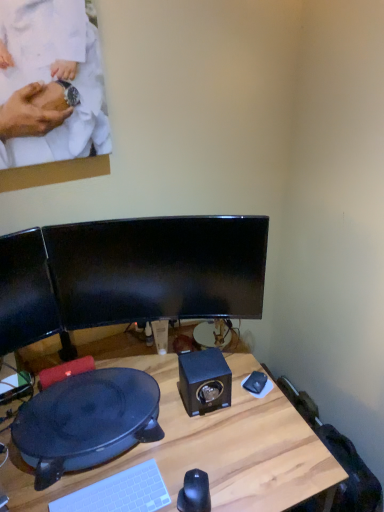
This screenshot has height=512, width=384. I want to click on free space above white plastic keyboard at lower center (from a real-world perspective), so click(x=114, y=494).